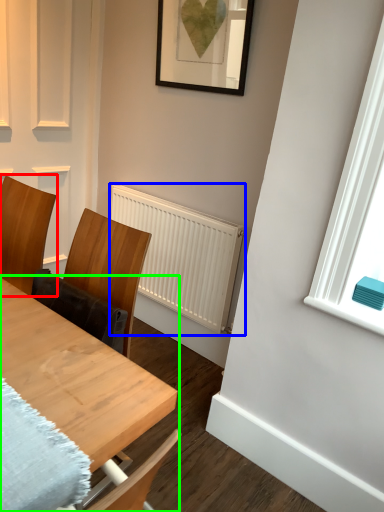
Question: Which object is positioned farthest from chair (highlighted by a red box)? Select from radiator (highlighted by a blue box) and table (highlighted by a green box).

Choices:
 (A) radiator
 (B) table

Answer: (A)